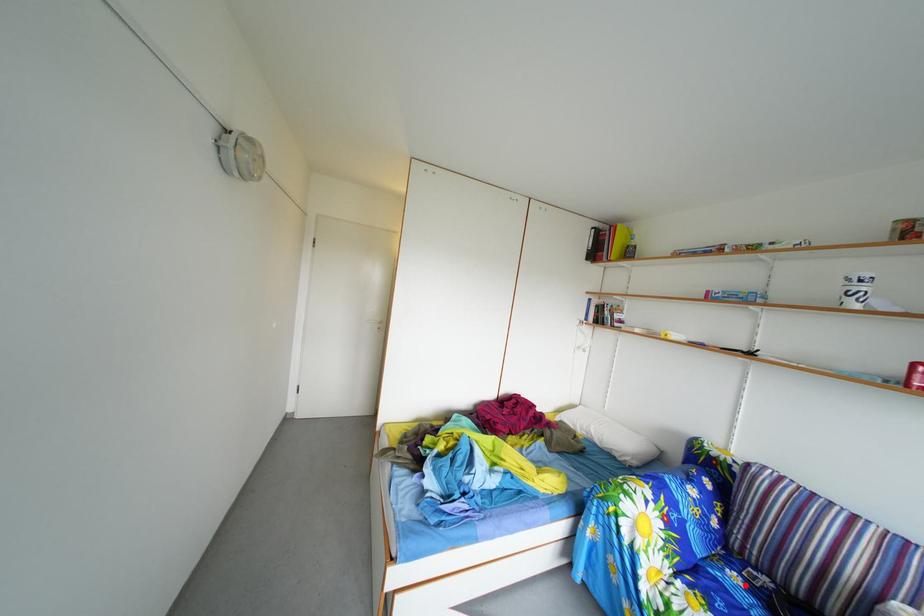
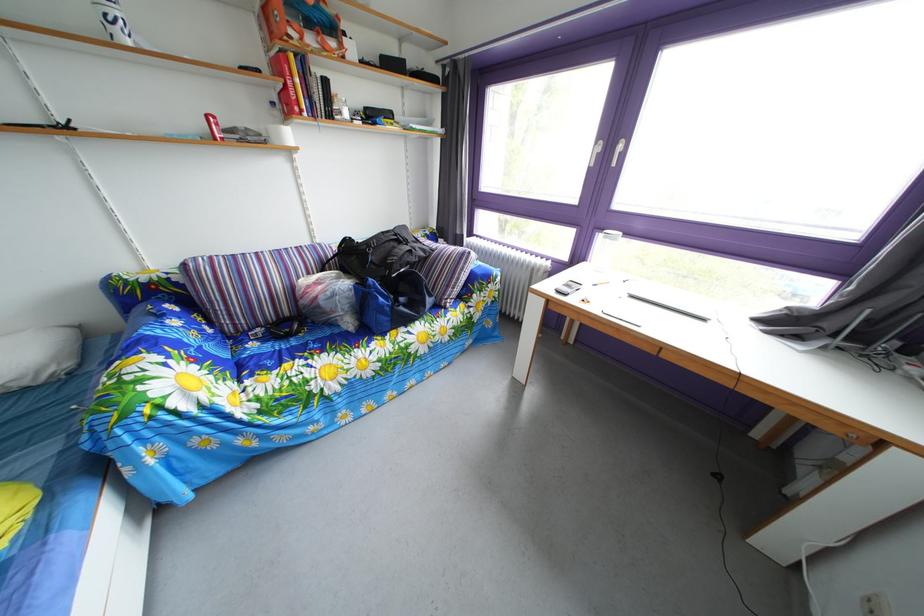
In the second image, find the point that corresponds to the highlighted location in the first image.

(262, 353)